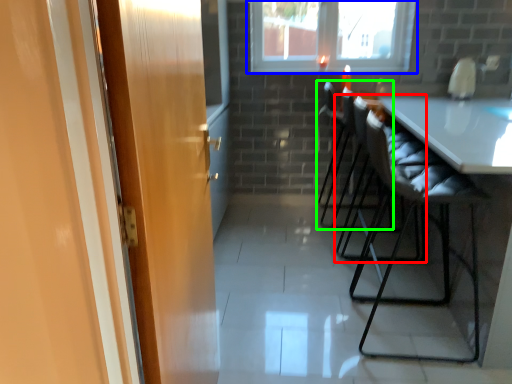
Question: Based on their relative distances, which object is nearer to chair (highlighted by a red box)? Choose from window (highlighted by a blue box) and chair (highlighted by a green box).

Choices:
 (A) window
 (B) chair

Answer: (B)